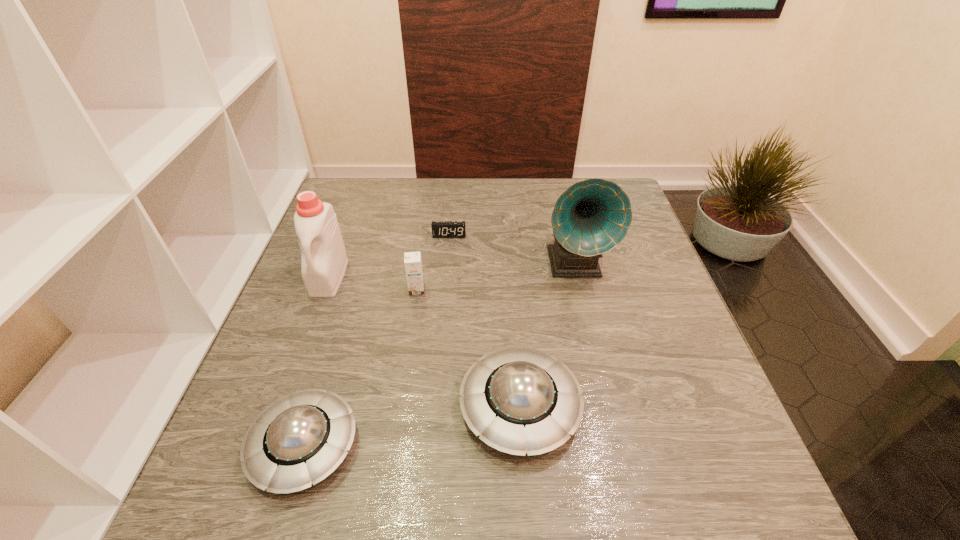
Locate an element on the screen. The width and height of the screenshot is (960, 540). the second shortest object is located at coordinates (298, 440).

Where is `the shorter saucer`? The height and width of the screenshot is (540, 960). the shorter saucer is located at coordinates (298, 440).

This screenshot has width=960, height=540. What are the coordinates of `the right saucer` in the screenshot? It's located at (521, 400).

The image size is (960, 540). Identify the location of chocolate milk. (412, 260).

At what (x,y) coordinates should I click in order to perform the action: click on the farthest object. Please return your answer as a coordinate pair (x, y). This screenshot has width=960, height=540. Looking at the image, I should click on (440, 229).

You are a GUI agent. You are given a task and a screenshot of the screen. Output one action in this format:
    pyautogui.click(x=<x>, y=<y>)
    Task: Click on the alarm clock
    
    Given the screenshot: What is the action you would take?
    pyautogui.click(x=440, y=229)

The width and height of the screenshot is (960, 540). What are the coordinates of `the tallest object` in the screenshot? It's located at (591, 217).

At what (x,y) coordinates should I click in order to perform the action: click on the fifth shortest object. Please return your answer as a coordinate pair (x, y). Looking at the image, I should click on (x=324, y=260).

What are the coordinates of `vacant space situated on the back of the shorter saucer` in the screenshot? It's located at (337, 337).

At what (x,y) coordinates should I click in order to perform the action: click on vacant space situated on the back of the right saucer. Please return your answer as a coordinate pair (x, y). Looking at the image, I should click on (511, 287).